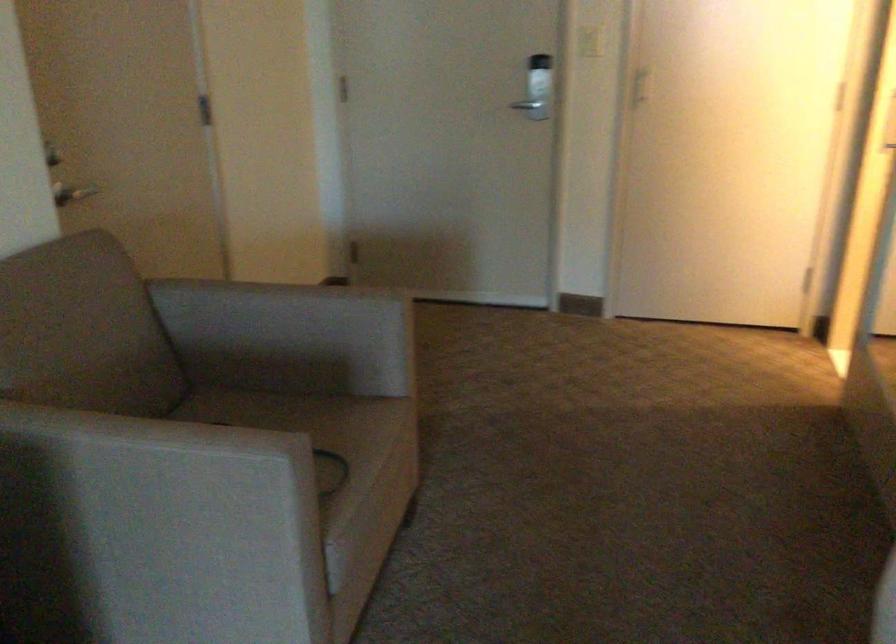
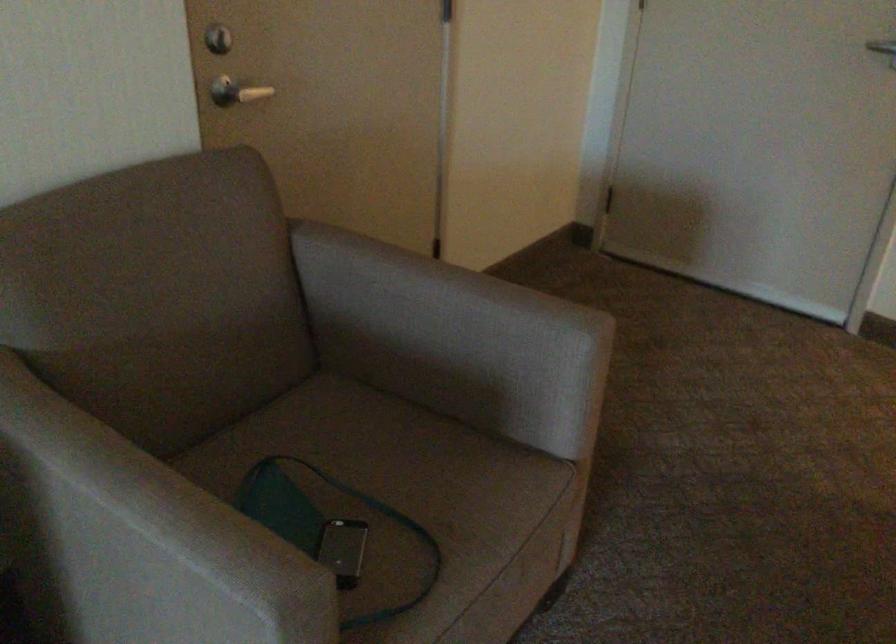
Locate, in the second image, the point that corresponds to point (524, 108) in the first image.

(882, 46)